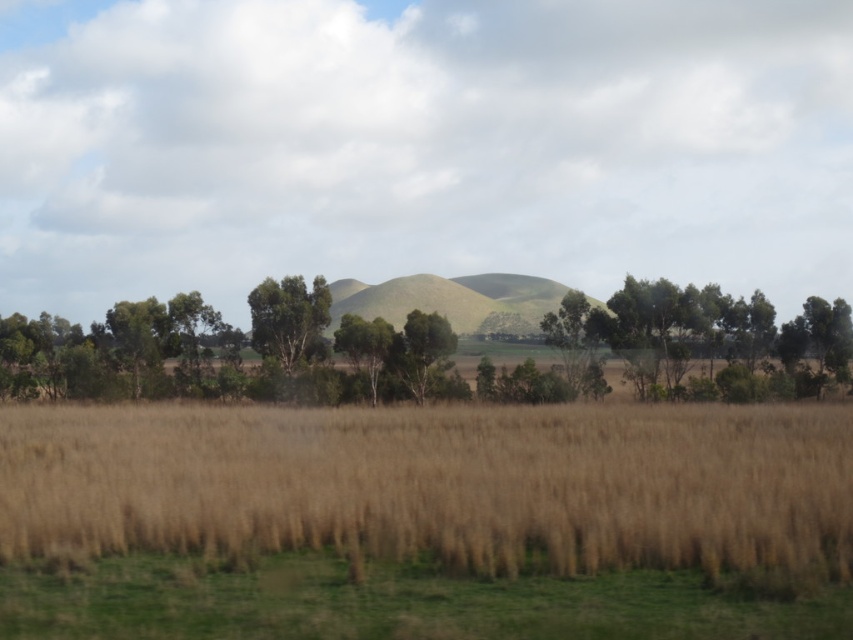
Between green grassy hill at center and green leafy tree at center, which one has less height?

green leafy tree at center is shorter.

Find the location of a particular element. Image resolution: width=853 pixels, height=640 pixels. green grassy hill at center is located at coordinates (451, 300).

Is brown dry grass at lower center positioned at the back of green leafy tree at center?

No, it is not.

Who is lower down, brown dry grass at lower center or green leafy tree at center?

brown dry grass at lower center is lower down.

Is point (248, 586) farther from camera compared to point (285, 360)?

No.

Identify the location of brown dry grass at lower center. (x=393, y=604).

Between point (631, 598) and point (456, 305), which one is positioned behind?

The point (456, 305) is more distant.

Does point (285, 554) come behind point (498, 284)?

No, it is not.

The width and height of the screenshot is (853, 640). Identify the location of brown dry grass at lower center. (393, 604).